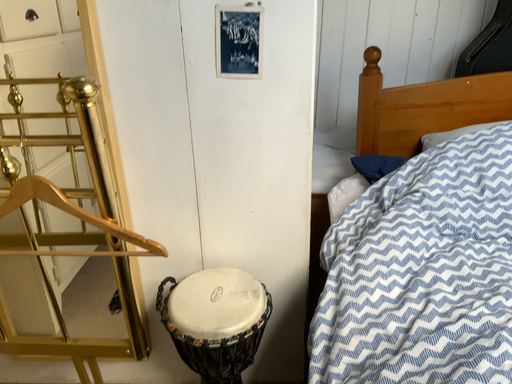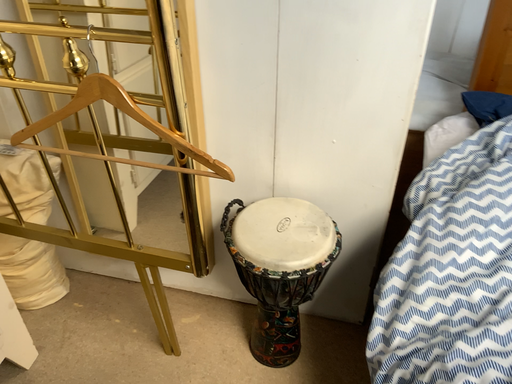
Question: How did the camera likely rotate when shooting the video?

Choices:
 (A) rotated downward
 (B) rotated upward

Answer: (A)